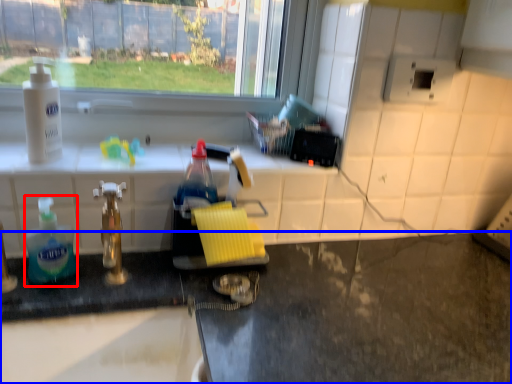
Question: Which object is further to the camera taking this photo, bottle (highlighted by a red box) or counter (highlighted by a blue box)?

Choices:
 (A) bottle
 (B) counter

Answer: (A)